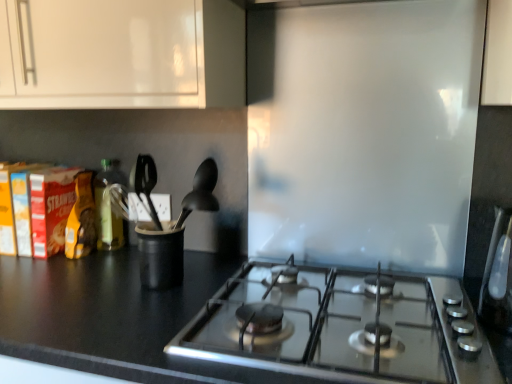
Locate an element on the screen. vacant area that is in front of green glass bottle at left is located at coordinates (83, 264).